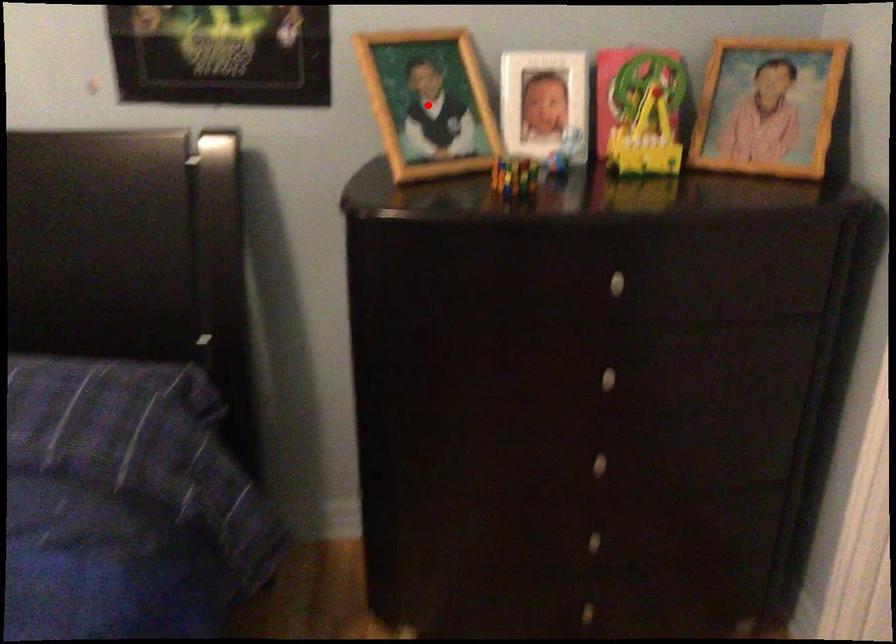
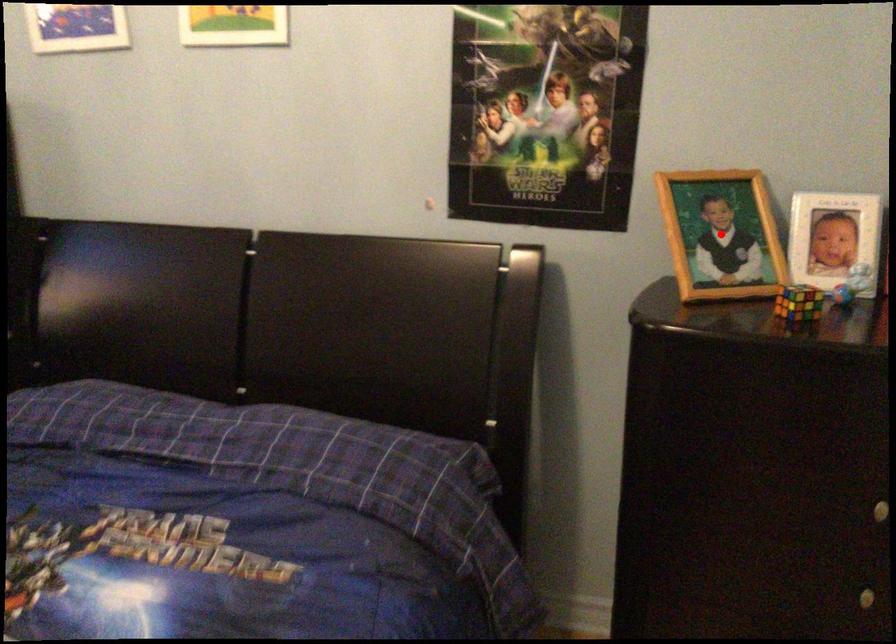
I am providing you with two images of the same scene from different viewpoints. A red point is marked on the first image and another point is marked on the second image. Do the highlighted points in image1 and image2 indicate the same real-world spot?

No